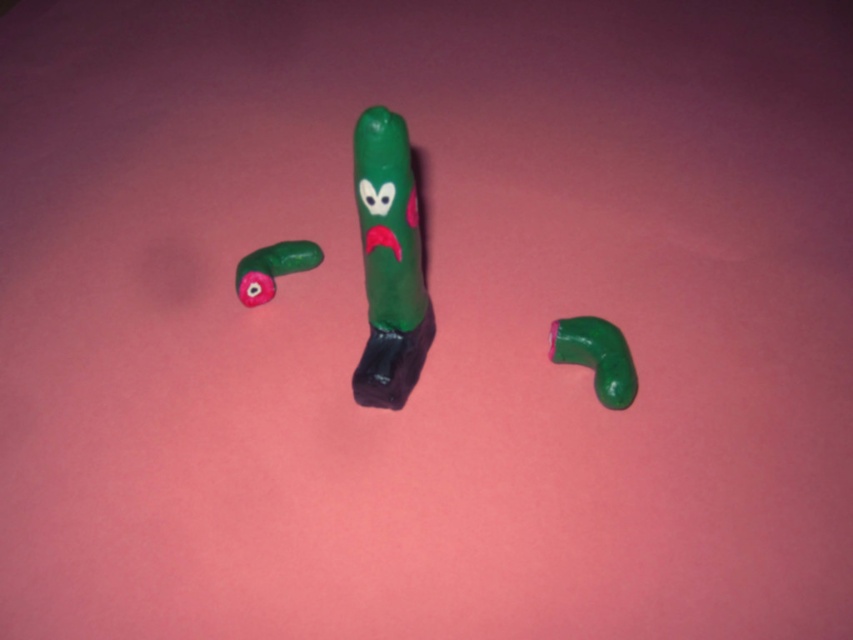
Question: Is green matte plastic toy at center smaller than rubber green cucumber at left?

Choices:
 (A) yes
 (B) no

Answer: (B)

Question: Which point is closer to the camera?

Choices:
 (A) coord(636,384)
 (B) coord(273,243)
 (C) coord(399,148)

Answer: (C)

Question: Is green matte toy at center wider than rubber green cucumber at left?

Choices:
 (A) no
 (B) yes

Answer: (A)

Question: Among these objects, which one is nearest to the camera?

Choices:
 (A) green matte plastic toy at center
 (B) rubber green cucumber at left

Answer: (A)

Question: Can you confirm if green matte plastic toy at center is positioned below green matte toy at center?

Choices:
 (A) yes
 (B) no

Answer: (B)

Question: Which object appears closest to the camera in this image?

Choices:
 (A) green matte toy at center
 (B) green matte plastic toy at center
 (C) rubber green cucumber at left

Answer: (B)